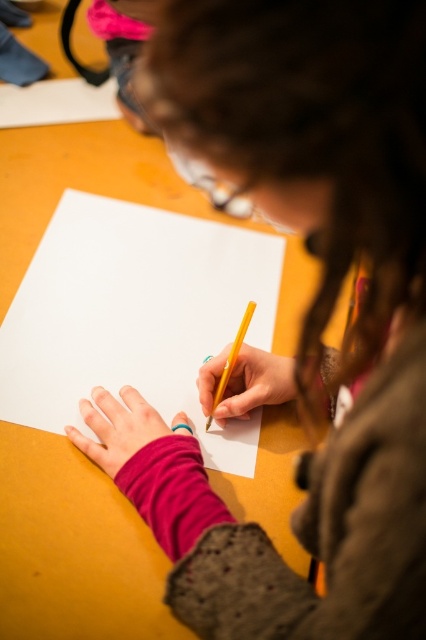
Question: Which point is farther to the camera?

Choices:
 (A) (80, 497)
 (B) (227, 360)

Answer: (B)

Question: Which object is farther from the camera taking this photo?

Choices:
 (A) white paper at center
 (B) wooden table at center

Answer: (A)

Question: Is wooden table at center to the right of yellow matte pencil at center from the viewer's perspective?

Choices:
 (A) yes
 (B) no

Answer: (B)

Question: Does wooden table at center have a lesser width compared to yellow matte pencil at center?

Choices:
 (A) yes
 (B) no

Answer: (B)

Question: Can you confirm if wooden table at center is positioned above white paper at center?

Choices:
 (A) no
 (B) yes

Answer: (B)

Question: Which point is farther to the camera?

Choices:
 (A) (227, 380)
 (B) (236, 260)

Answer: (B)